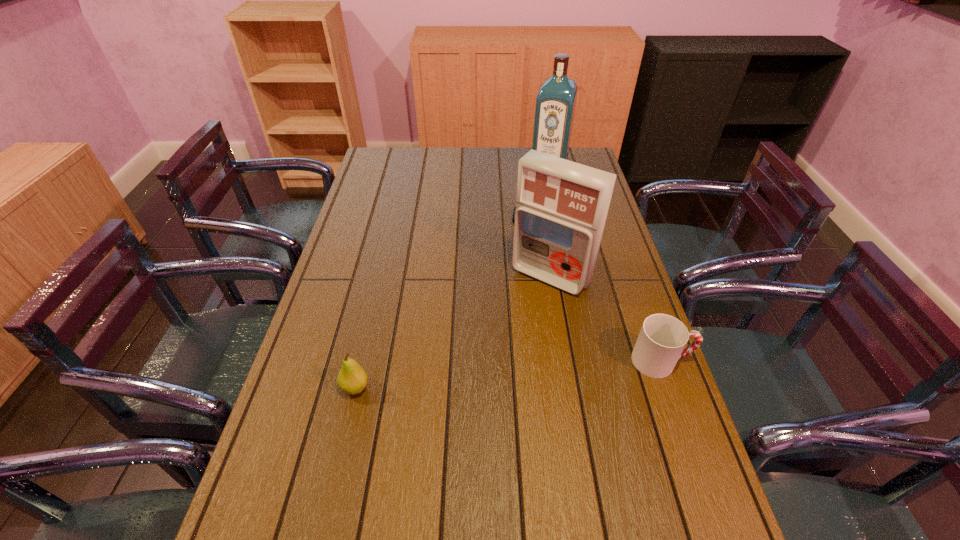
Locate an element on the screen. This screenshot has width=960, height=540. free spot located 0.180m on the display of the shortest object is located at coordinates (526, 261).

At what (x,y) coordinates should I click in order to perform the action: click on free space located on the flat label side of the farthest object. Please return your answer as a coordinate pair (x, y). Looking at the image, I should click on (527, 228).

Identify the location of free space located 0.120m on the flat label side of the farthest object. This screenshot has width=960, height=540. (540, 194).

Where is `vacant region located on the flat label side of the farthest object`? This screenshot has width=960, height=540. vacant region located on the flat label side of the farthest object is located at coordinates (527, 228).

This screenshot has height=540, width=960. What are the coordinates of `free space located 0.320m on the front-facing side of the first-aid kit` in the screenshot? It's located at (471, 373).

Find the location of `free space located 0.390m on the front-facing side of the first-aid kit`. free space located 0.390m on the front-facing side of the first-aid kit is located at coordinates (455, 393).

I want to click on free space located 0.080m on the front-facing side of the first-aid kit, so click(518, 312).

Where is `object that is at the far edge`? This screenshot has height=540, width=960. object that is at the far edge is located at coordinates (555, 104).

This screenshot has height=540, width=960. Find the location of `object present at the left edge`. object present at the left edge is located at coordinates (352, 379).

Find the location of a particular element. The height and width of the screenshot is (540, 960). cup at the right edge is located at coordinates (662, 338).